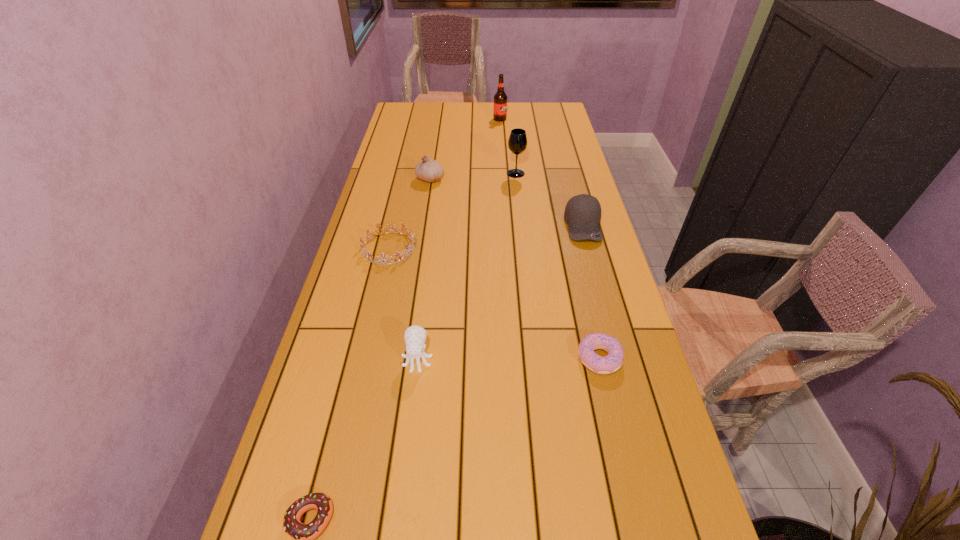
Where is `root beer`? root beer is located at coordinates (500, 98).

Locate an element on the screen. wineglass is located at coordinates (517, 143).

I want to click on garlic, so click(x=428, y=170).

Identify the location of baseball cap. This screenshot has height=540, width=960. (582, 213).

The image size is (960, 540). Identify the location of octopus. (415, 336).

Locate an element on the screen. This screenshot has width=960, height=540. tiara is located at coordinates (412, 238).

What are the coordinates of `the right doughnut` in the screenshot? It's located at (612, 362).

The image size is (960, 540). Find the location of `vacant space located on the back of the root beer`. vacant space located on the back of the root beer is located at coordinates [x=499, y=111].

This screenshot has height=540, width=960. In order to click on vacant space located on the front of the second tallest object in this screenshot , I will do `click(518, 198)`.

Where is `vacant region located on the back of the garlic`? vacant region located on the back of the garlic is located at coordinates (438, 130).